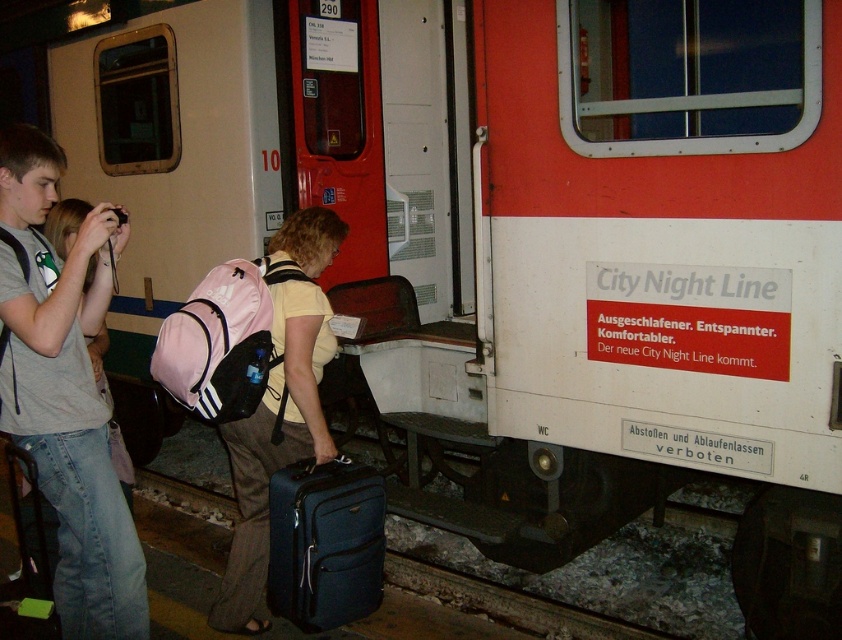
You are standing at the train station and want to reach the point marked as point (32,380). If your walking speed is 3 feet per second, how many seconds will it take you to reach that point?

The distance between you and point (32,380) is 8.18 feet. At a speed of 3 feet per second, dividing the distance by speed gives 8.18 divided by 3 equals approximately 2.73 seconds. So, it will take roughly 2.73 seconds to reach the point.

You are standing at the train station and see the matte pink backpack at center. Where exactly is it located in terms of coordinates?

The matte pink backpack at center is located at coordinates point (276,410).